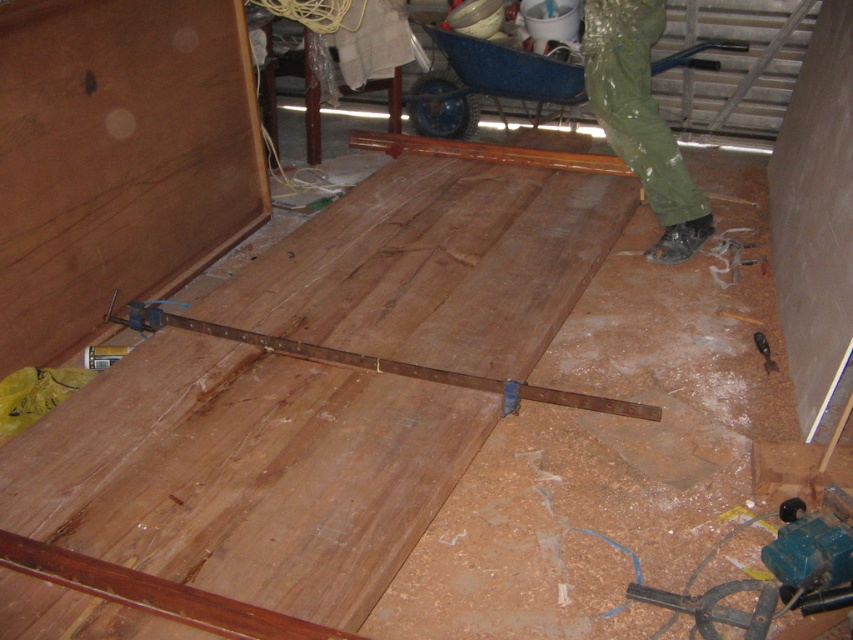
Can you confirm if green rubber pants at center is shorter than rusty metal ruler at center?

In fact, green rubber pants at center may be taller than rusty metal ruler at center.

Which is more to the right, green rubber pants at center or rusty metal ruler at center?

green rubber pants at center

Does point (640, 108) come behind point (376, 365)?

Yes, it is.

Identify the location of green rubber pants at center. The image size is (853, 640). (641, 120).

Does green rubber pants at center appear on the left side of metallic blue drill at lower right?

Yes, green rubber pants at center is to the left of metallic blue drill at lower right.

Is point (651, 157) behind point (767, 353)?

Yes, it is behind point (767, 353).

This screenshot has width=853, height=640. I want to click on green rubber pants at center, so click(641, 120).

You are a GUI agent. You are given a task and a screenshot of the screen. Output one action in this format:
    pyautogui.click(x=<x>, y=<y>)
    Task: Click on the green rubber pants at center
    
    Given the screenshot: What is the action you would take?
    pyautogui.click(x=641, y=120)

Who is more forward, [265,340] or [764,355]?

Point [265,340]

Which of these two, rusty metal ruler at center or metallic blue drill at lower right, stands shorter?

With less height is metallic blue drill at lower right.

Identify the location of rusty metal ruler at center. The image size is (853, 640). (376, 362).

Identify the location of rusty metal ruler at center. This screenshot has height=640, width=853. (376, 362).